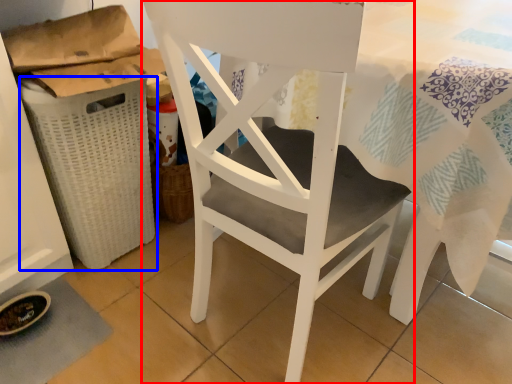
Question: Among these objects, which one is farthest to the camera, chair (highlighted by a red box) or laundry basket (highlighted by a blue box)?

Choices:
 (A) chair
 (B) laundry basket

Answer: (B)